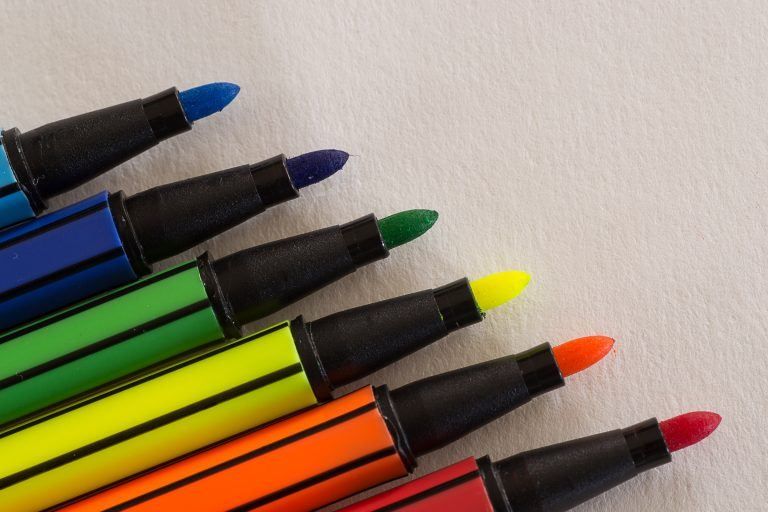
This screenshot has width=768, height=512. Find the location of `marker`. marker is located at coordinates (103, 139), (161, 215), (253, 278), (389, 333), (458, 401), (555, 480).